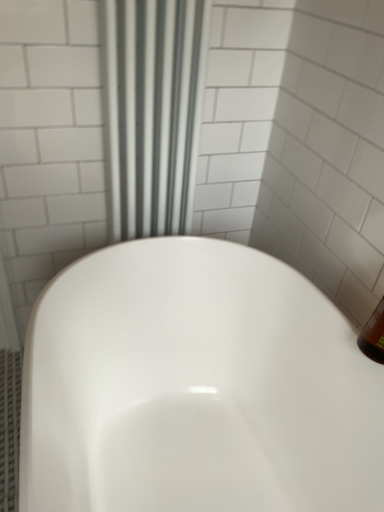
Question: From the image's perspective, would you say white glossy bathtub at center is shown under white fabric shower curtain at upper center?

Choices:
 (A) no
 (B) yes

Answer: (B)

Question: Does white glossy bathtub at center contain white fabric shower curtain at upper center?

Choices:
 (A) yes
 (B) no

Answer: (B)

Question: Can you confirm if white glossy bathtub at center is taller than white fabric shower curtain at upper center?

Choices:
 (A) no
 (B) yes

Answer: (A)

Question: Considering the relative sizes of white glossy bathtub at center and white fabric shower curtain at upper center in the image provided, is white glossy bathtub at center thinner than white fabric shower curtain at upper center?

Choices:
 (A) yes
 (B) no

Answer: (B)

Question: Considering the relative sizes of white glossy bathtub at center and white fabric shower curtain at upper center in the image provided, is white glossy bathtub at center wider than white fabric shower curtain at upper center?

Choices:
 (A) no
 (B) yes

Answer: (B)

Question: Can you confirm if white glossy bathtub at center is bigger than white fabric shower curtain at upper center?

Choices:
 (A) no
 (B) yes

Answer: (B)

Question: Is white fabric shower curtain at upper center positioned beyond the bounds of white glossy bathtub at center?

Choices:
 (A) no
 (B) yes

Answer: (B)

Question: Does white fabric shower curtain at upper center appear on the right side of white glossy bathtub at center?

Choices:
 (A) yes
 (B) no

Answer: (B)

Question: Is white fabric shower curtain at upper center aimed at white glossy bathtub at center?

Choices:
 (A) no
 (B) yes

Answer: (B)

Question: From the image's perspective, is white fabric shower curtain at upper center above white glossy bathtub at center?

Choices:
 (A) no
 (B) yes

Answer: (B)

Question: From a real-world perspective, is white fabric shower curtain at upper center on top of white glossy bathtub at center?

Choices:
 (A) no
 (B) yes

Answer: (B)

Question: Can you confirm if white fabric shower curtain at upper center is thinner than white glossy bathtub at center?

Choices:
 (A) yes
 (B) no

Answer: (A)

Question: Is white glossy bathtub at center wider or thinner than white fabric shower curtain at upper center?

Choices:
 (A) wide
 (B) thin

Answer: (A)